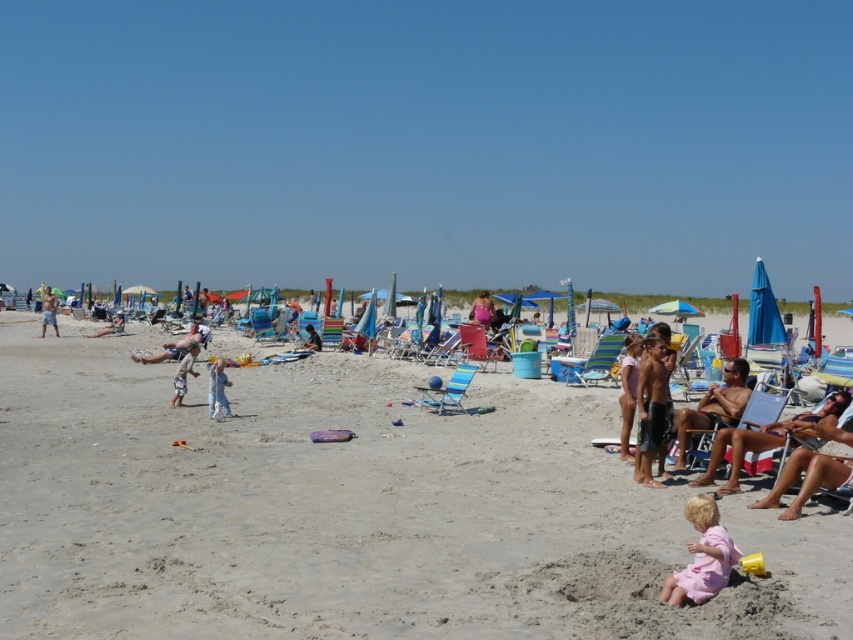
Question: Does pink fabric bikini at lower right come in front of wooden beach chair at center?

Choices:
 (A) yes
 (B) no

Answer: (A)

Question: Which object is the closest to the tan skin man at left?

Choices:
 (A) tan skin sunbather at right
 (B) blue fabric umbrella at right
 (C) matte red beach chair at center
 (D) pink fabric dress at lower right

Answer: (C)

Question: Which point is farther to the camera?

Choices:
 (A) (802, 566)
 (B) (769, 296)
 (C) (793, 461)

Answer: (B)

Question: Considering the relative positions of tan skin man at center and pink fabric bikini at center in the image provided, where is tan skin man at center located with respect to pink fabric bikini at center?

Choices:
 (A) below
 (B) above

Answer: (A)

Question: Can you confirm if tan skin sunbather at right is smaller than tan skin person at center?

Choices:
 (A) yes
 (B) no

Answer: (A)

Question: Which point appears closest to the camera in this image?

Choices:
 (A) (686, 572)
 (B) (318, 339)
 (C) (619, 410)
 (D) (86, 337)

Answer: (A)